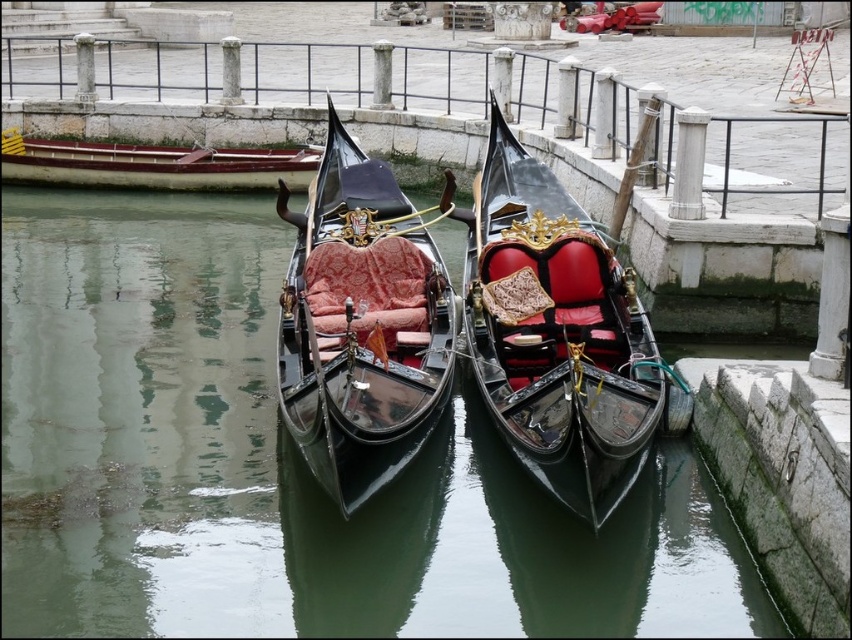
Question: Is glossy black water at center below shiny black gondola at center?

Choices:
 (A) no
 (B) yes

Answer: (B)

Question: Which point is closer to the camera?

Choices:
 (A) brushed metal rail at upper center
 (B) wooden polished boat at left

Answer: (A)

Question: Which point is farther from the camera taking this photo?

Choices:
 (A) (419, 605)
 (B) (465, 330)

Answer: (B)

Question: Which object is closer to the camera taking this photo?

Choices:
 (A) glossy black water at center
 (B) shiny black gondola at center
 (C) wooden polished boat at left
 (D) polished wood gondola at center

Answer: (B)

Question: Is glossy black water at center thinner than wooden polished boat at left?

Choices:
 (A) yes
 (B) no

Answer: (B)

Question: Does glossy black water at center have a smaller size compared to wooden polished boat at left?

Choices:
 (A) yes
 (B) no

Answer: (B)